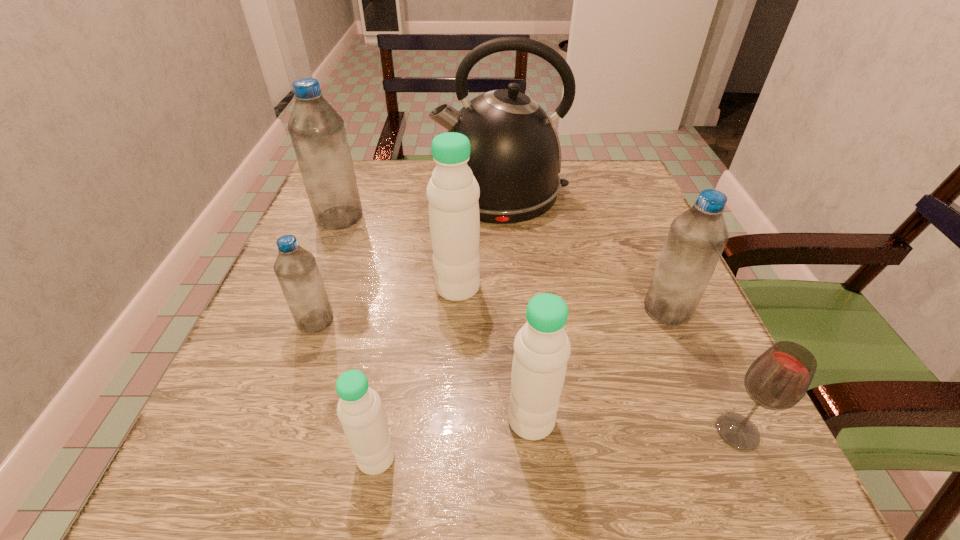
Find the location of a particular element. The width and height of the screenshot is (960, 540). free location located 0.150m on the front of the smallest blue water bottle is located at coordinates (281, 415).

Where is `free region located on the right of the smallest white water bottle`? free region located on the right of the smallest white water bottle is located at coordinates (536, 457).

Locate an element on the screen. free location located 0.150m on the left of the glass drink container is located at coordinates (609, 432).

The height and width of the screenshot is (540, 960). In order to click on kettle that is at the far edge in this screenshot , I will do `click(515, 156)`.

I want to click on water bottle present at the far edge, so click(317, 131).

Find the location of a particular element. The width and height of the screenshot is (960, 540). glass drink container that is at the near edge is located at coordinates (778, 379).

I want to click on water bottle present at the right edge, so click(696, 239).

You are a GUI agent. You are given a task and a screenshot of the screen. Output one action in this format:
    pyautogui.click(x=<x>, y=<y>)
    Task: Click on the glass drink container at the right edge
    Image resolution: width=960 pixels, height=540 pixels.
    Given the screenshot: What is the action you would take?
    pyautogui.click(x=778, y=379)

The height and width of the screenshot is (540, 960). What are the coordinates of `object that is at the far left corner` in the screenshot? It's located at (317, 131).

The height and width of the screenshot is (540, 960). What are the coordinates of `object located in the near right corner section of the desktop` in the screenshot? It's located at (778, 379).